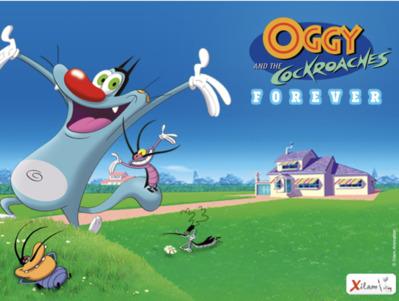
This screenshot has height=301, width=399. Identify the location of windows. (308, 182), (350, 185), (288, 182), (290, 166).